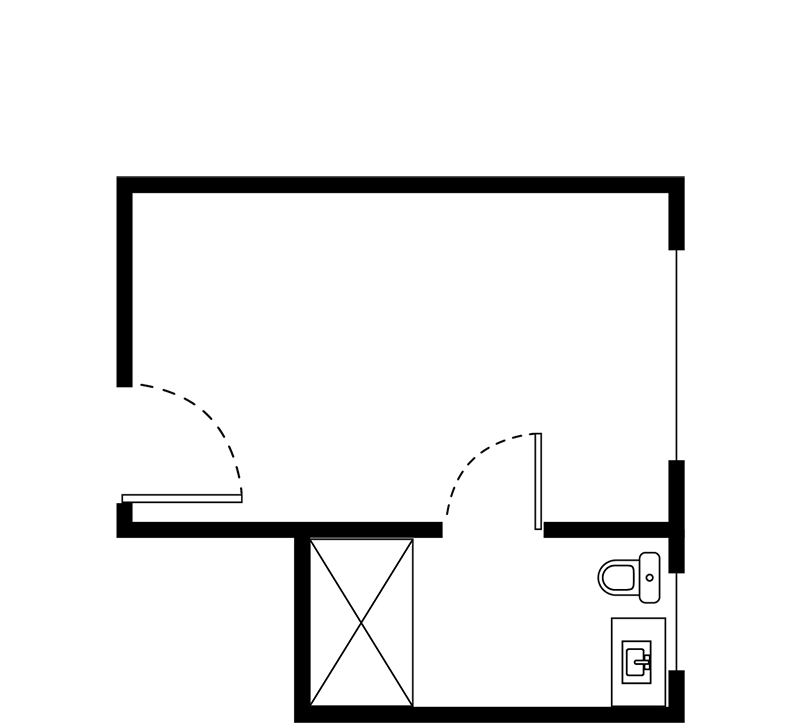
The width and height of the screenshot is (800, 723). What are the coordinates of `bathtub` in the screenshot? It's located at (392, 630).